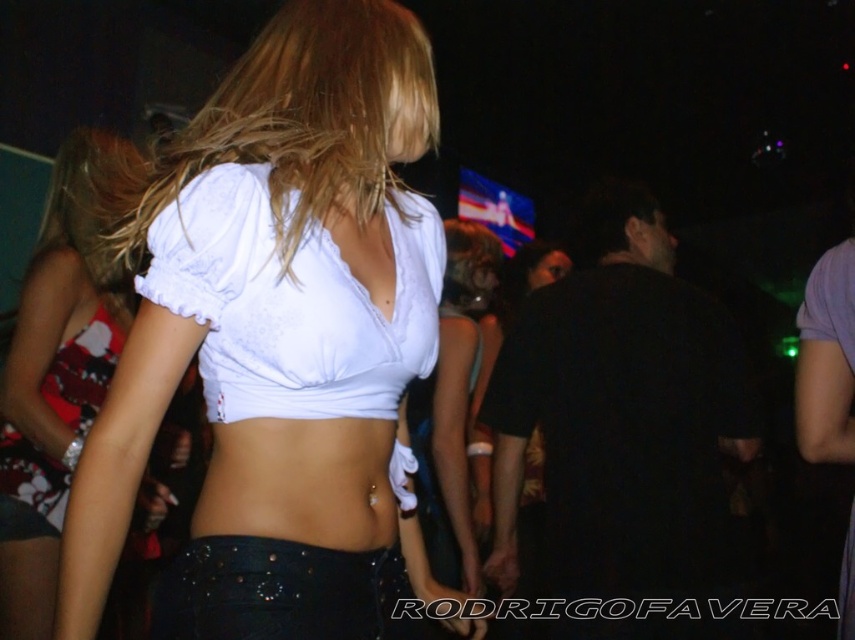
Question: Which point is farther to the camera?

Choices:
 (A) (431, 496)
 (B) (369, 92)
 (C) (374, 468)

Answer: (A)

Question: Which point appears farthest from the camera in this image?

Choices:
 (A) (204, 147)
 (B) (447, 515)
 (C) (293, 200)

Answer: (B)

Question: Observing the image, what is the correct spatial positioning of white matte fabric top at center in reference to white lace bikini top at center?

Choices:
 (A) right
 (B) left

Answer: (B)

Question: Can you confirm if blondehair at center is wider than white cotton top at center?

Choices:
 (A) no
 (B) yes

Answer: (B)

Question: Is white matte fabric top at center to the left of blondehair at center from the viewer's perspective?

Choices:
 (A) yes
 (B) no

Answer: (B)

Question: Which is nearer to the white lace bikini top at center?

Choices:
 (A) white cotton top at center
 (B) white matte fabric top at center

Answer: (B)